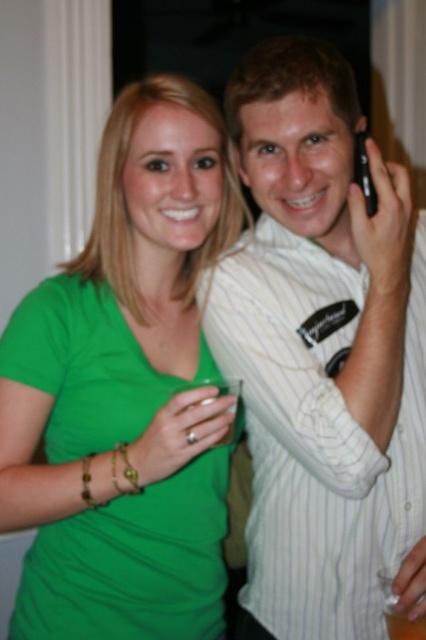
This screenshot has width=426, height=640. What do you see at coordinates (322, 353) in the screenshot? I see `white striped shirt at upper right` at bounding box center [322, 353].

Based on the photo, who is taller, white striped shirt at upper right or black plastic phone at upper right?

Standing taller between the two is white striped shirt at upper right.

Which is behind, point (301, 84) or point (359, 147)?

Positioned behind is point (359, 147).

The width and height of the screenshot is (426, 640). I want to click on white striped shirt at upper right, so click(x=322, y=353).

Which is in front, point (397, 614) or point (359, 163)?

Point (397, 614) is more forward.

Can you confirm if translucent glass at upper right is positioned to the right of black plastic phone at upper right?

Indeed, translucent glass at upper right is positioned on the right side of black plastic phone at upper right.

Find the location of a particular element. translucent glass at upper right is located at coordinates (402, 621).

Who is positioned more to the left, green matte shirt at center or translucent glass at upper right?

green matte shirt at center is more to the left.

Who is taller, green matte shirt at center or translucent glass at upper right?

green matte shirt at center is taller.

Locate an element on the screen. green matte shirt at center is located at coordinates (126, 390).